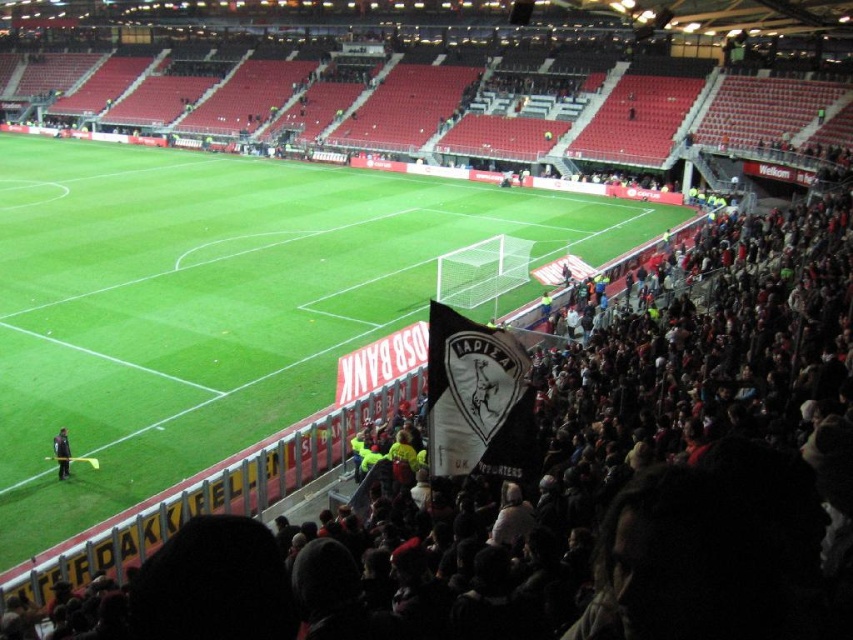
You are a drone operator flying a drone over the soccer stadium. Your drone is currently at point (215, 301). What is the immediate surface your drone is hovering over?

The immediate surface at point (215, 301) is green grass at center.

You are a photographer at the soccer stadium trying to capture a wide shot of the field. You notice the green grass at center and the dark gray uniform at lower left in your viewfinder. Which object will appear larger in your photo?

The green grass at center will appear larger in the photo because it is bigger than the dark gray uniform at lower left according to the description.